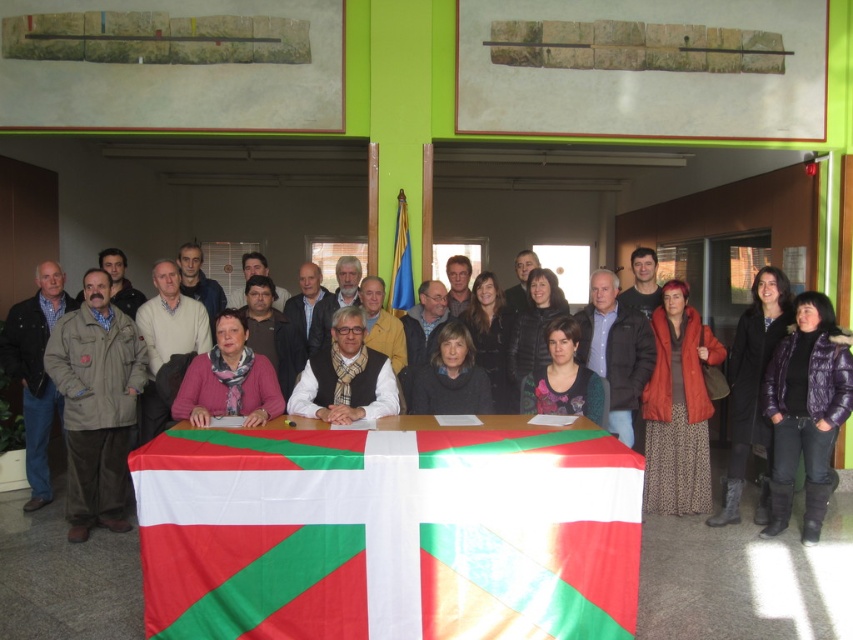
Who is taller, khaki fabric jacket at left or blue fabric flag at center?

khaki fabric jacket at left

Between khaki fabric jacket at left and blue fabric flag at center, which one is positioned lower?

khaki fabric jacket at left is lower down.

Where is `khaki fabric jacket at left`? khaki fabric jacket at left is located at coordinates (96, 403).

Where is `khaki fabric jacket at left`? The width and height of the screenshot is (853, 640). khaki fabric jacket at left is located at coordinates (96, 403).

Between leopard print skirt at lower right and dark gray sweater at center, which one has less height?

dark gray sweater at center

Between leopard print skirt at lower right and dark gray sweater at center, which one has more height?

leopard print skirt at lower right

Where is `leopard print skirt at lower right`? The height and width of the screenshot is (640, 853). leopard print skirt at lower right is located at coordinates (677, 408).

Can you confirm if khaki fabric jacket at left is taller than pink matte scarf at center?

Correct, khaki fabric jacket at left is much taller as pink matte scarf at center.

Consider the image. Can you confirm if khaki fabric jacket at left is thinner than pink matte scarf at center?

Indeed, khaki fabric jacket at left has a lesser width compared to pink matte scarf at center.

This screenshot has width=853, height=640. In order to click on khaki fabric jacket at left in this screenshot , I will do `click(96, 403)`.